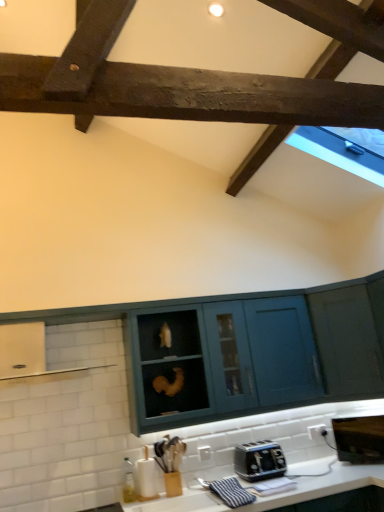
Question: From the image's perspective, does teal matte cabinet at center, which appears as the second cabinetry when viewed from the right, appear higher than white glossy exhaust hood at left?

Choices:
 (A) yes
 (B) no

Answer: (B)

Question: From a real-world perspective, is teal matte cabinet at center, which is the second cabinetry from left to right, beneath white glossy exhaust hood at left?

Choices:
 (A) no
 (B) yes

Answer: (B)

Question: Considering the relative sizes of teal matte cabinet at center, which appears as the second cabinetry when viewed from the right, and white glossy exhaust hood at left in the image provided, is teal matte cabinet at center, which appears as the second cabinetry when viewed from the right, taller than white glossy exhaust hood at left?

Choices:
 (A) no
 (B) yes

Answer: (B)

Question: Does teal matte cabinet at center, which appears as the second cabinetry when viewed from the right, have a lesser width compared to white glossy exhaust hood at left?

Choices:
 (A) no
 (B) yes

Answer: (B)

Question: From the image's perspective, would you say teal matte cabinet at center, which appears as the second cabinetry when viewed from the right, is shown under white glossy exhaust hood at left?

Choices:
 (A) yes
 (B) no

Answer: (A)

Question: Considering the positions of teal matte cabinet at center, which appears as the second cabinetry when viewed from the right, and teal matte cabinet at center, arranged as the first cabinetry when viewed from the left, in the image, is teal matte cabinet at center, which appears as the second cabinetry when viewed from the right, bigger or smaller than teal matte cabinet at center, arranged as the first cabinetry when viewed from the left,?

Choices:
 (A) small
 (B) big

Answer: (B)

Question: From a real-world perspective, is teal matte cabinet at center, which appears as the second cabinetry when viewed from the right, positioned above or below teal matte cabinet at center, positioned as the 3th cabinetry in right-to-left order?

Choices:
 (A) below
 (B) above

Answer: (B)

Question: Is point (264, 337) positioned closer to the camera than point (304, 351)?

Choices:
 (A) closer
 (B) farther

Answer: (A)

Question: From the image's perspective, relative to teal matte cabinet at center, positioned as the 3th cabinetry in right-to-left order, is teal matte cabinet at center, which is the second cabinetry from left to right, above or below?

Choices:
 (A) above
 (B) below

Answer: (A)

Question: From the image's perspective, relative to white glossy exhaust hood at left, is black metallic microwave at lower right above or below?

Choices:
 (A) below
 (B) above

Answer: (A)

Question: Considering the positions of black metallic microwave at lower right and white glossy exhaust hood at left in the image, is black metallic microwave at lower right wider or thinner than white glossy exhaust hood at left?

Choices:
 (A) thin
 (B) wide

Answer: (A)

Question: From a real-world perspective, is black metallic microwave at lower right above or below white glossy exhaust hood at left?

Choices:
 (A) above
 (B) below

Answer: (B)

Question: Is black metallic microwave at lower right in front of or behind white glossy exhaust hood at left in the image?

Choices:
 (A) front
 (B) behind

Answer: (B)

Question: Considering their positions, is white glossy countertop at lower center located in front of or behind black metallic toaster at lower center?

Choices:
 (A) front
 (B) behind

Answer: (A)

Question: Considering the positions of white glossy countertop at lower center and black metallic toaster at lower center in the image, is white glossy countertop at lower center bigger or smaller than black metallic toaster at lower center?

Choices:
 (A) big
 (B) small

Answer: (A)